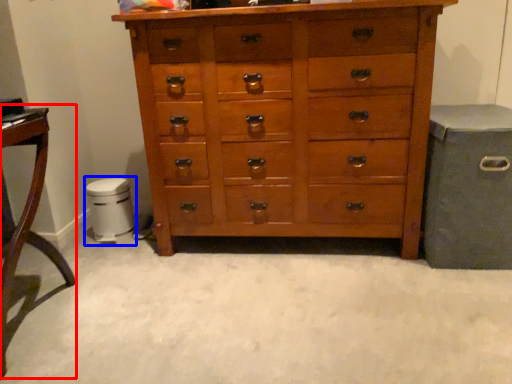
Question: Which object is closer to the camera taking this photo, table (highlighted by a red box) or music stool (highlighted by a blue box)?

Choices:
 (A) table
 (B) music stool

Answer: (A)